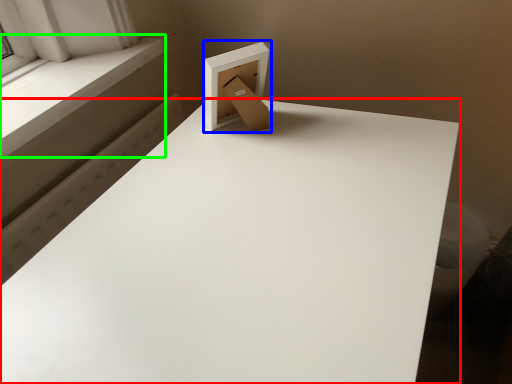
Question: Based on their relative distances, which object is nearer to table (highlighted by a red box)? Choose from cardboard box (highlighted by a blue box) and window sill (highlighted by a green box).

Choices:
 (A) cardboard box
 (B) window sill

Answer: (A)